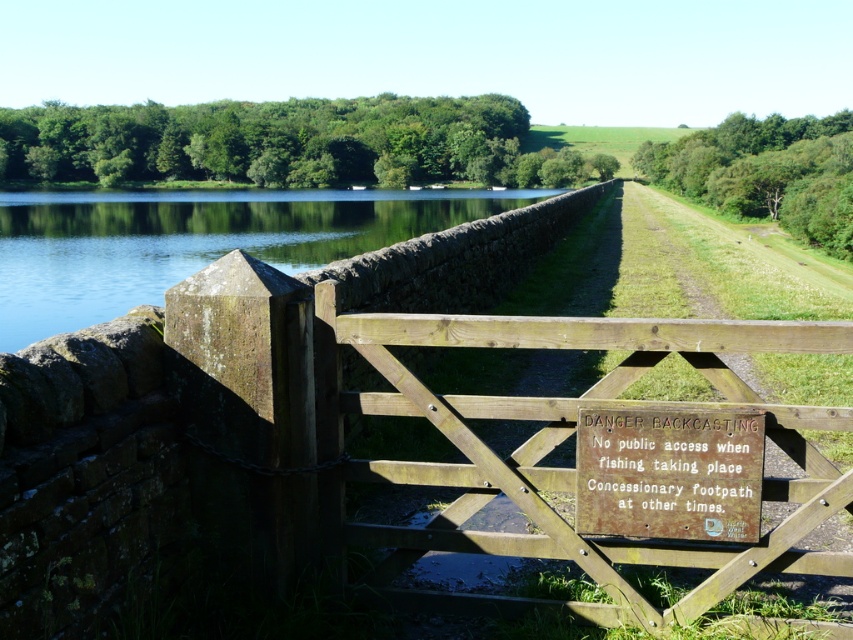
Question: Does green stone wall at upper left appear under rusty wooden sign at center?

Choices:
 (A) yes
 (B) no

Answer: (B)

Question: Among these objects, which one is farthest from the camera?

Choices:
 (A) rusty wooden sign at center
 (B) green stone wall at upper left

Answer: (B)

Question: Which point is closer to the camera taking this photo?

Choices:
 (A) (595, 512)
 (B) (126, 244)

Answer: (A)

Question: Is green stone wall at upper left further to camera compared to rusty wooden sign at center?

Choices:
 (A) yes
 (B) no

Answer: (A)

Question: Is green stone wall at upper left positioned at the back of rusty wooden sign at center?

Choices:
 (A) yes
 (B) no

Answer: (A)